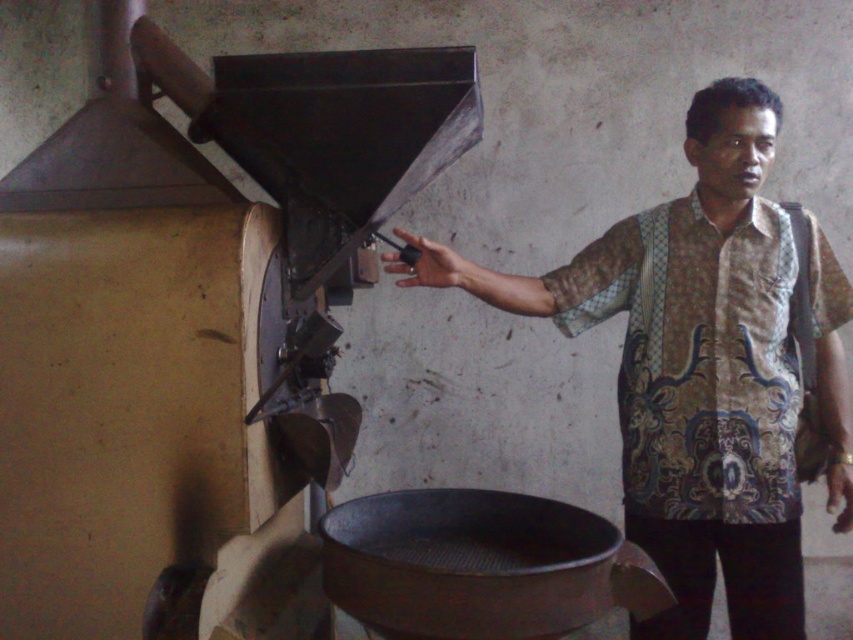
Question: Is batik shirt at center bigger than metallic at left?

Choices:
 (A) yes
 (B) no

Answer: (A)

Question: Among these objects, which one is nearest to the camera?

Choices:
 (A) matte brown hand at center
 (B) batik fabric shirt at right

Answer: (B)

Question: Is batik shirt at center above batik fabric shirt at right?

Choices:
 (A) no
 (B) yes

Answer: (A)

Question: Which point appears closest to the camera in this image?

Choices:
 (A) (672, 548)
 (B) (845, 509)
 (C) (410, 246)

Answer: (C)

Question: Which object appears closest to the camera in this image?

Choices:
 (A) metallic at left
 (B) matte brown hand at center

Answer: (A)

Question: Can you confirm if batik fabric shirt at right is positioned above metallic at left?

Choices:
 (A) yes
 (B) no

Answer: (B)